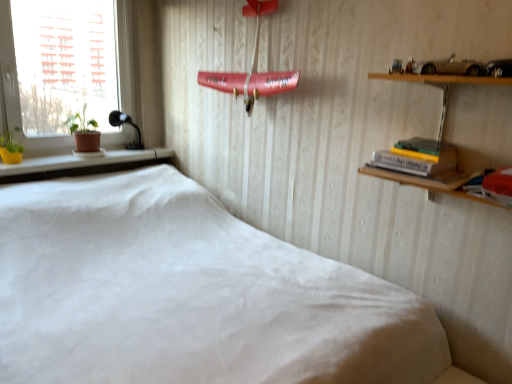
Question: Considering the positions of point (105, 137) and point (128, 119), is point (105, 137) closer or farther from the camera than point (128, 119)?

Choices:
 (A) closer
 (B) farther

Answer: (A)

Question: From the image's perspective, is white plastic window at left above or below black glass lamp at left?

Choices:
 (A) below
 (B) above

Answer: (B)

Question: Estimate the real-world distances between objects in this image. Which object is closer to the black glass lamp at left?

Choices:
 (A) white fabric bed at center
 (B) yellow matte flower pot at left
 (C) white plastic window at left
 (D) yellow matte plant at left
 (E) matte red book at right, the second book from the left

Answer: (C)

Question: Which is nearer to the yellow matte flower pot at left?

Choices:
 (A) matte red book at right, positioned as the second book in back-to-front order
 (B) white fabric bed at center
 (C) yellow matte plant at left
 (D) black glass lamp at left
 (E) white plastic window at left

Answer: (D)